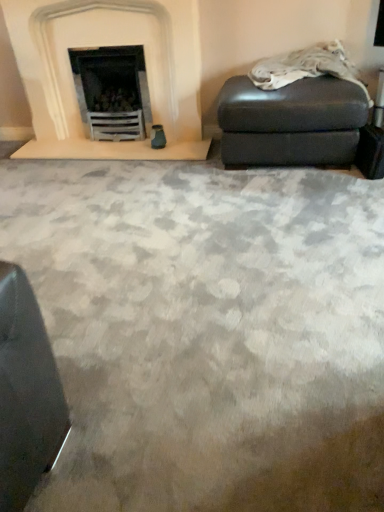
Question: Is matte gray ottoman at right at the right side of leather ottoman at upper right?

Choices:
 (A) yes
 (B) no

Answer: (B)

Question: Is matte gray ottoman at right next to leather ottoman at upper right?

Choices:
 (A) no
 (B) yes

Answer: (A)

Question: Is matte gray ottoman at right shorter than leather ottoman at upper right?

Choices:
 (A) yes
 (B) no

Answer: (B)

Question: Considering the relative sizes of matte gray ottoman at right and leather ottoman at upper right in the image provided, is matte gray ottoman at right thinner than leather ottoman at upper right?

Choices:
 (A) yes
 (B) no

Answer: (B)

Question: From a real-world perspective, is matte gray ottoman at right positioned under leather ottoman at upper right based on gravity?

Choices:
 (A) no
 (B) yes

Answer: (B)

Question: Considering the relative sizes of matte gray ottoman at right and leather ottoman at upper right in the image provided, is matte gray ottoman at right taller than leather ottoman at upper right?

Choices:
 (A) yes
 (B) no

Answer: (A)

Question: Is white stone fireplace at upper left at the left side of matte gray ottoman at right?

Choices:
 (A) no
 (B) yes

Answer: (B)

Question: Considering the relative sizes of white stone fireplace at upper left and matte gray ottoman at right in the image provided, is white stone fireplace at upper left bigger than matte gray ottoman at right?

Choices:
 (A) no
 (B) yes

Answer: (B)

Question: From the image's perspective, is white stone fireplace at upper left on top of matte gray ottoman at right?

Choices:
 (A) no
 (B) yes

Answer: (B)

Question: Can you confirm if white stone fireplace at upper left is thinner than matte gray ottoman at right?

Choices:
 (A) yes
 (B) no

Answer: (A)

Question: Does white stone fireplace at upper left lie behind matte gray ottoman at right?

Choices:
 (A) yes
 (B) no

Answer: (A)

Question: Would you say matte gray ottoman at right is part of white stone fireplace at upper left's contents?

Choices:
 (A) no
 (B) yes

Answer: (A)

Question: Considering the relative sizes of leather ottoman at upper right and matte gray ottoman at right in the image provided, is leather ottoman at upper right thinner than matte gray ottoman at right?

Choices:
 (A) yes
 (B) no

Answer: (A)